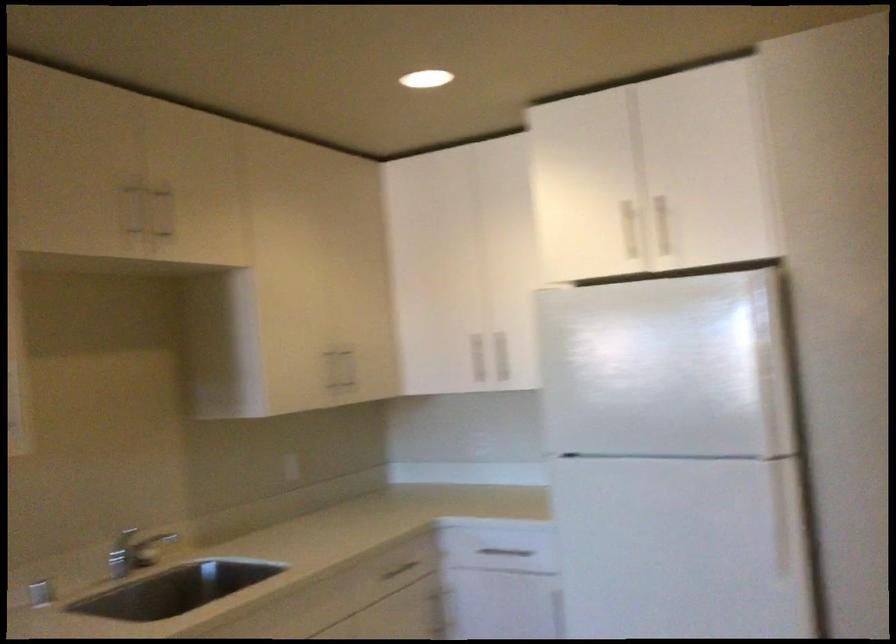
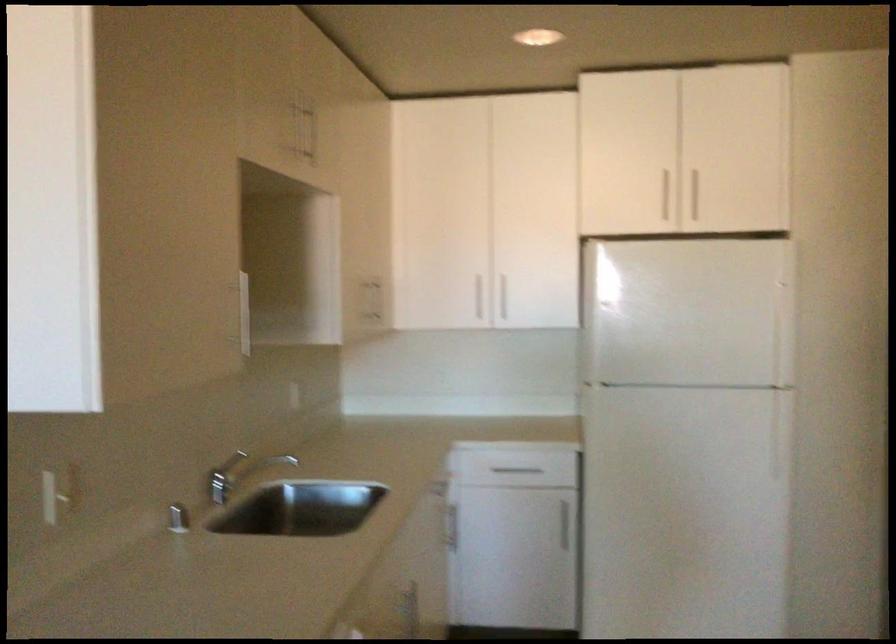
The point at (659,223) is marked in the first image. Where is the corresponding point in the second image?

(695, 196)